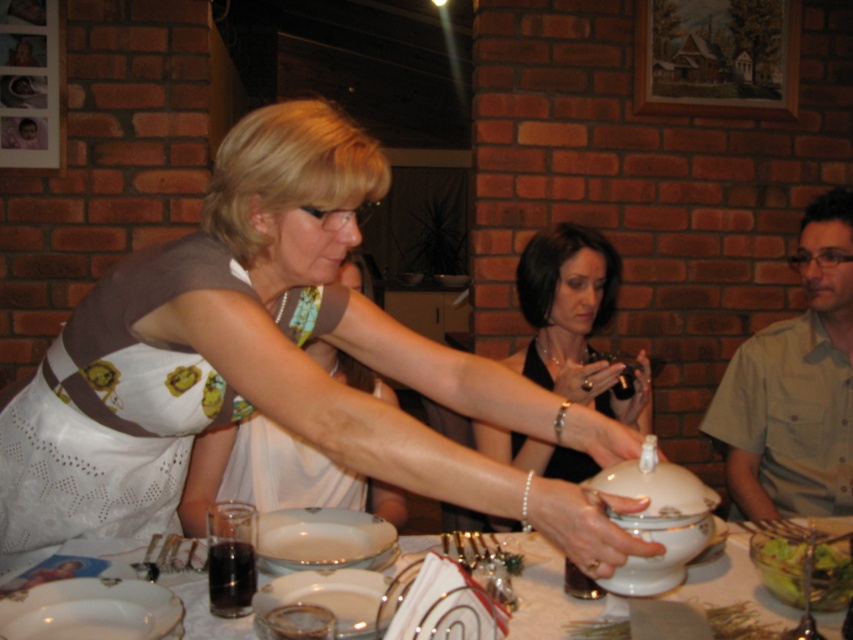
Question: Considering the relative positions of white porcelain bowl at center and white glossy platter at center in the image provided, where is white porcelain bowl at center located with respect to white glossy platter at center?

Choices:
 (A) left
 (B) right

Answer: (B)

Question: Estimate the real-world distances between objects in this image. Which object is closer to the white porcelain bowl at center?

Choices:
 (A) matte black camera at center
 (B) gold metallic platter at center

Answer: (B)

Question: Can you confirm if light beige shirt at right is smaller than green leafy salad at lower right?

Choices:
 (A) yes
 (B) no

Answer: (B)

Question: Is light beige shirt at right wider than matte black camera at center?

Choices:
 (A) yes
 (B) no

Answer: (B)

Question: Estimate the real-world distances between objects in this image. Which object is closer to the white porcelain platter at lower left?

Choices:
 (A) pearl bracelet at center
 (B) light beige shirt at right
 (C) white glossy platter at center
 (D) white glossy lid at center

Answer: (C)

Question: Which point appears farthest from the camera in this image?

Choices:
 (A) (590, 541)
 (B) (67, 548)

Answer: (B)